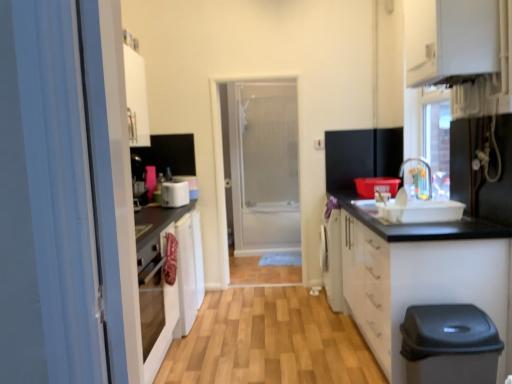
Question: From a real-world perspective, is white glossy cabinet at lower right, the first cabinetry ordered from the bottom, located beneath transparent glass door at center?

Choices:
 (A) no
 (B) yes

Answer: (B)

Question: Is white glossy cabinet at lower right, the first cabinetry ordered from the bottom, closer to camera compared to transparent glass door at center?

Choices:
 (A) no
 (B) yes

Answer: (B)

Question: From the image's perspective, is white glossy cabinet at lower right, the 2th cabinetry viewed from the top, on transparent glass door at center?

Choices:
 (A) no
 (B) yes

Answer: (A)

Question: Is white glossy cabinet at lower right, the first cabinetry ordered from the bottom, at the left side of transparent glass door at center?

Choices:
 (A) no
 (B) yes

Answer: (A)

Question: Is white glossy cabinet at lower right, the first cabinetry ordered from the bottom, facing away from transparent glass door at center?

Choices:
 (A) no
 (B) yes

Answer: (A)

Question: From the image's perspective, is metallic silver faucet at upper right, which is the first appliance in front-to-back order, above or below white glossy cabinet at lower right, the first cabinetry ordered from the bottom?

Choices:
 (A) above
 (B) below

Answer: (A)

Question: From their relative heights in the image, would you say metallic silver faucet at upper right, which is the second appliance from left to right, is taller or shorter than white glossy cabinet at lower right, the first cabinetry ordered from the bottom?

Choices:
 (A) tall
 (B) short

Answer: (B)

Question: Considering the positions of metallic silver faucet at upper right, which is the second appliance from left to right, and white glossy cabinet at lower right, the first cabinetry ordered from the bottom, in the image, is metallic silver faucet at upper right, which is the second appliance from left to right, wider or thinner than white glossy cabinet at lower right, the first cabinetry ordered from the bottom,?

Choices:
 (A) thin
 (B) wide

Answer: (A)

Question: From a real-world perspective, is metallic silver faucet at upper right, marked as the first appliance in a right-to-left arrangement, above or below white glossy cabinet at lower right, the first cabinetry ordered from the bottom?

Choices:
 (A) below
 (B) above

Answer: (B)

Question: From the image's perspective, relative to white plastic toaster at center, which is counted as the first appliance, starting from the back, is metallic silver faucet at upper right, which is the second appliance from left to right, above or below?

Choices:
 (A) below
 (B) above

Answer: (B)

Question: Considering their positions, is metallic silver faucet at upper right, marked as the first appliance in a right-to-left arrangement, located in front of or behind white plastic toaster at center, the first appliance positioned from the left?

Choices:
 (A) behind
 (B) front

Answer: (B)

Question: Is point (467, 150) closer or farther from the camera than point (176, 196)?

Choices:
 (A) closer
 (B) farther

Answer: (A)

Question: In the image, is metallic silver faucet at upper right, which is the second appliance from left to right, on the left side or the right side of white plastic toaster at center, marked as the second appliance in a right-to-left arrangement?

Choices:
 (A) right
 (B) left

Answer: (A)

Question: Would you say white glossy cabinet at upper right, arranged as the first cabinetry when viewed from the top, is to the left or to the right of metallic silver faucet at upper right, marked as the first appliance in a right-to-left arrangement, in the picture?

Choices:
 (A) right
 (B) left

Answer: (B)

Question: Considering the positions of white glossy cabinet at upper right, arranged as the first cabinetry when viewed from the top, and metallic silver faucet at upper right, which ranks as the second appliance in back-to-front order, in the image, is white glossy cabinet at upper right, arranged as the first cabinetry when viewed from the top, wider or thinner than metallic silver faucet at upper right, which ranks as the second appliance in back-to-front order,?

Choices:
 (A) thin
 (B) wide

Answer: (B)